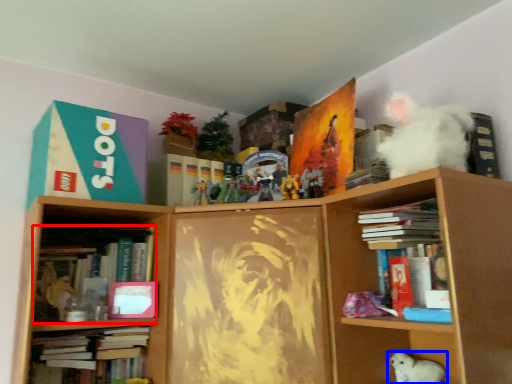
Question: Which object appears farthest to the camera in this image, book (highlighted by a red box) or toy (highlighted by a blue box)?

Choices:
 (A) book
 (B) toy

Answer: (A)